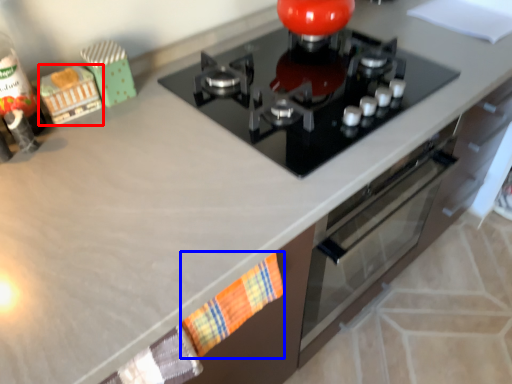
Question: Which object appears farthest to the camera in this image, toy (highlighted by a red box) or hand towel (highlighted by a blue box)?

Choices:
 (A) toy
 (B) hand towel

Answer: (A)